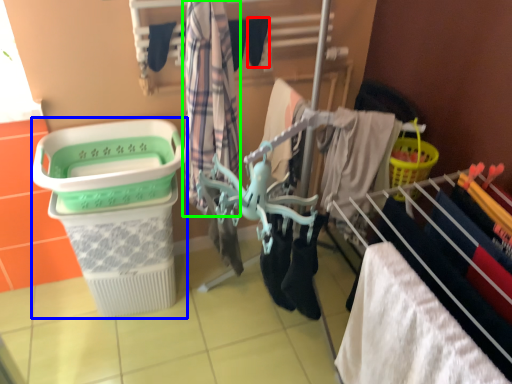
Question: Estimate the real-world distances between objects in this image. Which object is farther from shoe (highlighted by a red box), shopping basket (highlighted by a blue box) or clothing (highlighted by a green box)?

Choices:
 (A) shopping basket
 (B) clothing

Answer: (A)